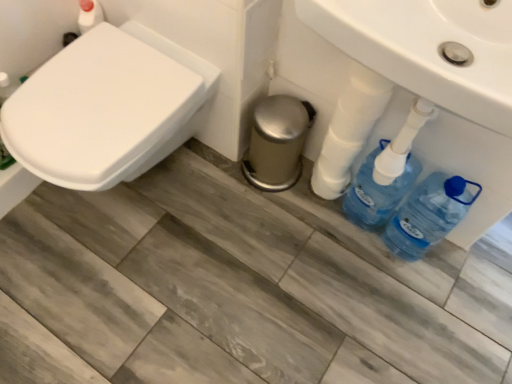
Question: Considering the positions of point (154, 104) and point (424, 36), is point (154, 104) closer or farther from the camera than point (424, 36)?

Choices:
 (A) closer
 (B) farther

Answer: (B)

Question: Is white glossy toilet at left taller or shorter than white glossy sink at center?

Choices:
 (A) tall
 (B) short

Answer: (A)

Question: Which object is the closest to the white glossy sink at center?

Choices:
 (A) blue plastic bottles at lower right
 (B) blue plastic bottle at lower right
 (C) white glossy toilet at left

Answer: (A)

Question: Based on their relative distances, which object is farther from the white glossy sink at center?

Choices:
 (A) white glossy toilet at left
 (B) blue plastic bottles at lower right
 (C) blue plastic bottle at lower right

Answer: (A)